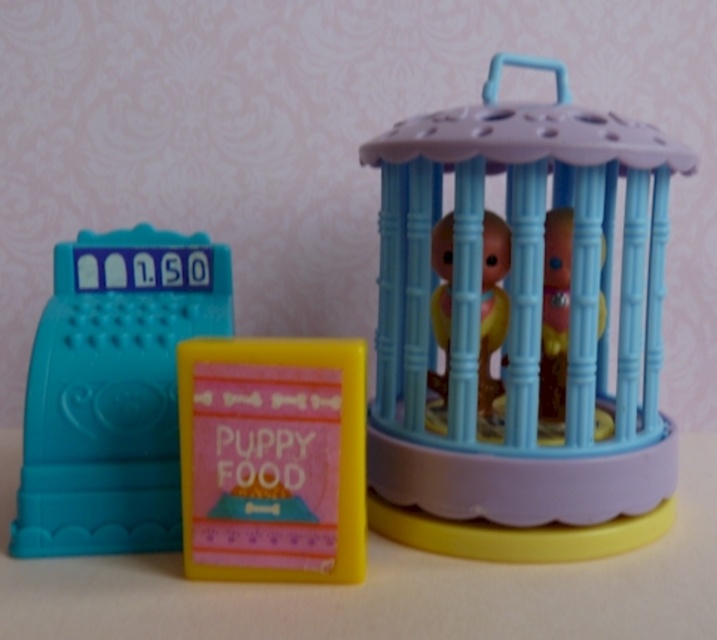
Is matte plastic cash register at left smaller than yellow matte puppy food at center?

Incorrect, matte plastic cash register at left is not smaller in size than yellow matte puppy food at center.

Does matte plastic cash register at left have a lesser height compared to yellow matte puppy food at center?

No.

The height and width of the screenshot is (640, 717). Identify the location of matte plastic cash register at left. [x=113, y=390].

In order to click on matte plastic cash register at left in this screenshot , I will do `click(113, 390)`.

Which of these two, pastel blue plastic birdcage at right or matte plastic cash register at left, stands taller?

pastel blue plastic birdcage at right is taller.

Does pastel blue plastic birdcage at right appear under matte plastic cash register at left?

Incorrect, pastel blue plastic birdcage at right is not positioned below matte plastic cash register at left.

The height and width of the screenshot is (640, 717). What do you see at coordinates (521, 333) in the screenshot?
I see `pastel blue plastic birdcage at right` at bounding box center [521, 333].

Identify the location of pastel blue plastic birdcage at right. The width and height of the screenshot is (717, 640). (521, 333).

Which is in front, point (630, 157) or point (358, 538)?

Point (358, 538) is more forward.

Is pastel blue plastic birdcage at right positioned behind yellow matte puppy food at center?

Yes.

Measure the distance between pastel blue plastic birdcage at right and camera.

pastel blue plastic birdcage at right and camera are 30.68 inches apart.

You are a GUI agent. You are given a task and a screenshot of the screen. Output one action in this format:
    pyautogui.click(x=<x>, y=<y>)
    Task: Click on the pastel blue plastic birdcage at right
    Image resolution: width=717 pixels, height=640 pixels.
    Given the screenshot: What is the action you would take?
    pyautogui.click(x=521, y=333)